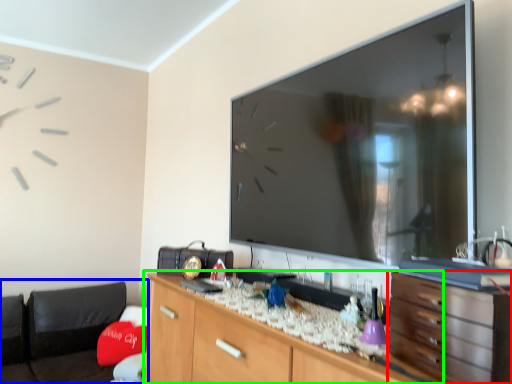
Question: Considering the real-world distances, which object is closest to chest of drawers (highlighted by a red box)? bean bag chair (highlighted by a blue box) or cabinetry (highlighted by a green box).

Choices:
 (A) bean bag chair
 (B) cabinetry

Answer: (B)